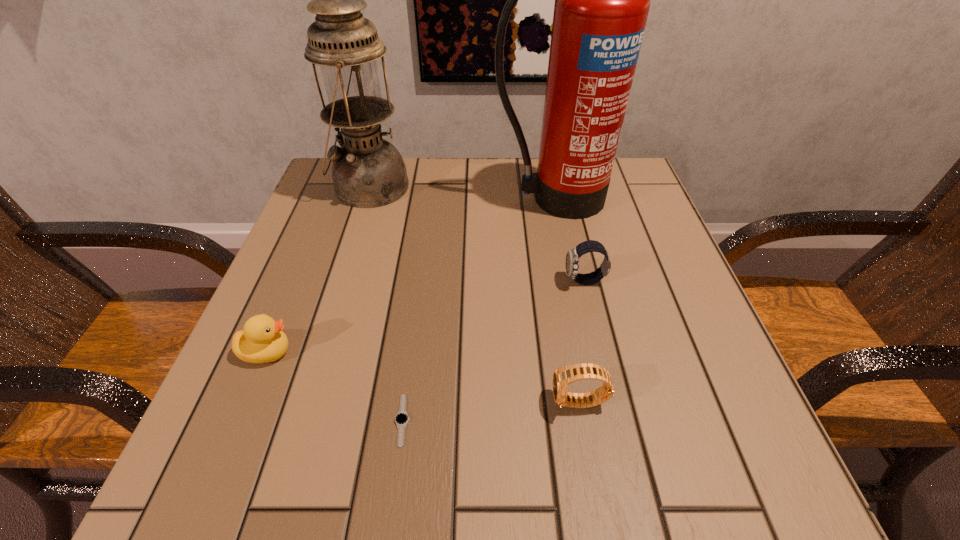
This screenshot has height=540, width=960. Find the location of `unoccupied position between the fire extinguisher and the fourth farthest object`. unoccupied position between the fire extinguisher and the fourth farthest object is located at coordinates [410, 275].

Where is `unoccupied area between the oil lamp and the fourth farthest object`? unoccupied area between the oil lamp and the fourth farthest object is located at coordinates (319, 269).

Identify the location of vacant space in between the farthest watch and the leftmost watch. (493, 350).

Identify the location of vacant area between the duckling and the second tallest object. Image resolution: width=960 pixels, height=540 pixels. (319, 269).

Find the location of a particular element. The height and width of the screenshot is (540, 960). the fifth closest object to the oil lamp is located at coordinates (563, 376).

Select which object appears as the fifth closest to the third nearest object. Please provide its 2D coordinates. Your answer should be formatted as a tuple, i.e. [(x, y)], where the tuple contains the x and y coordinates of a point satisfying the conditions above.

[(572, 258)]

At what (x,y) coordinates should I click in order to perform the action: click on the second closest watch to the leftmost watch. Please return your answer as a coordinate pair (x, y). The width and height of the screenshot is (960, 540). Looking at the image, I should click on (572, 258).

I want to click on the second closest watch to the fourth farthest object, so click(563, 376).

This screenshot has width=960, height=540. Find the location of `free space in the image that satisfies the following two spatial constraints: 1. on the front side of the oil lamp; 2. on the left side of the shortest object`. free space in the image that satisfies the following two spatial constraints: 1. on the front side of the oil lamp; 2. on the left side of the shortest object is located at coordinates (297, 420).

The height and width of the screenshot is (540, 960). Identify the location of vacant space that satisfies the following two spatial constraints: 1. on the back side of the shortest watch; 2. on the face of the duckling. (412, 352).